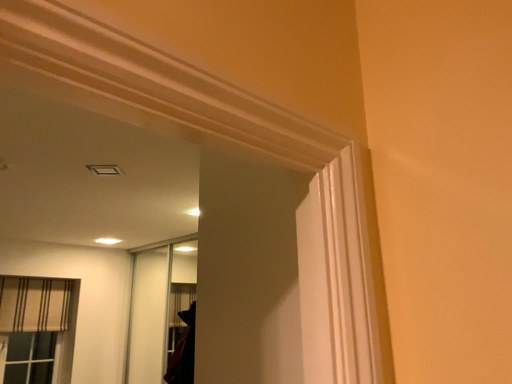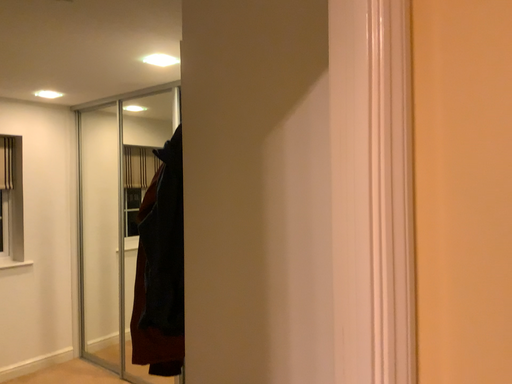
Question: Which way did the camera rotate in the video?

Choices:
 (A) rotated downward
 (B) rotated upward

Answer: (A)